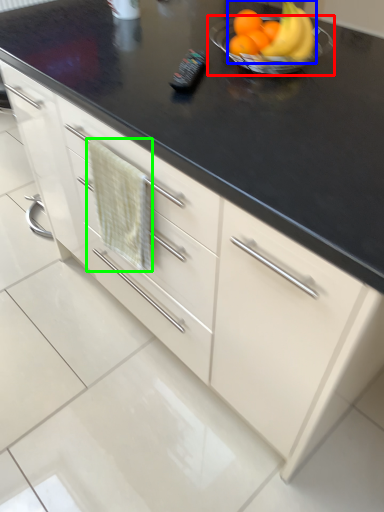
Question: Which is nearer to the glass bowl (highlighted by a red box)? grapefruit (highlighted by a blue box) or hand towel (highlighted by a green box).

Choices:
 (A) grapefruit
 (B) hand towel

Answer: (A)